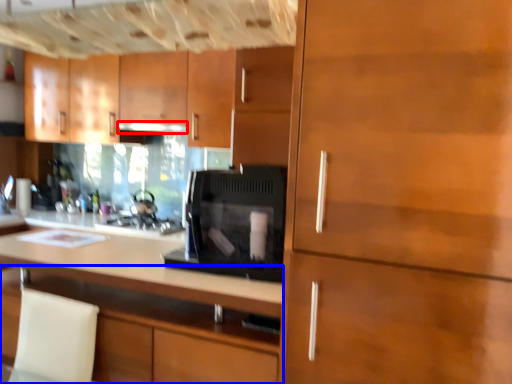
Question: Which object appears farthest to the camera in this image, exhaust hood (highlighted by a red box) or cabinetry (highlighted by a blue box)?

Choices:
 (A) exhaust hood
 (B) cabinetry

Answer: (A)